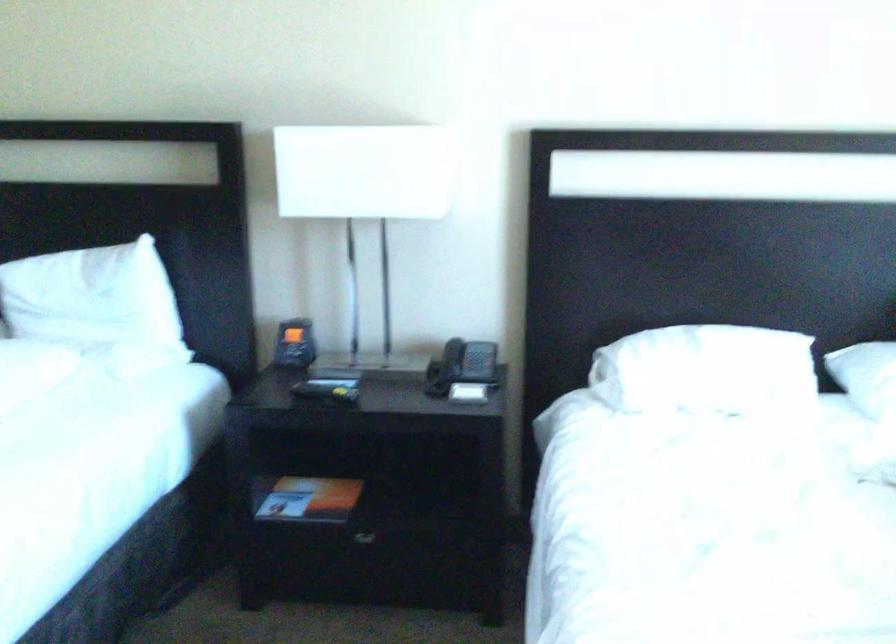
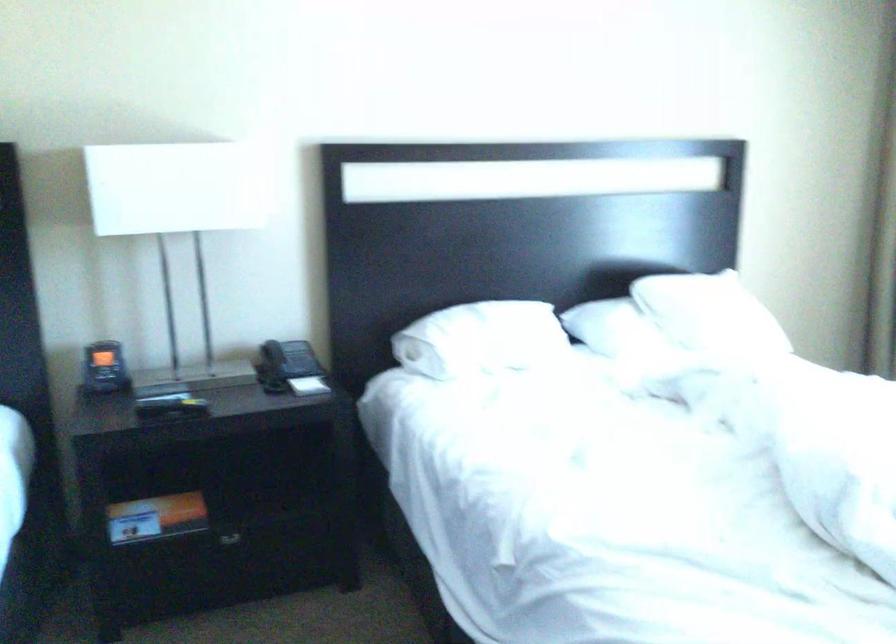
In the second image, find the point that corresponds to (x=684, y=365) in the first image.

(479, 339)